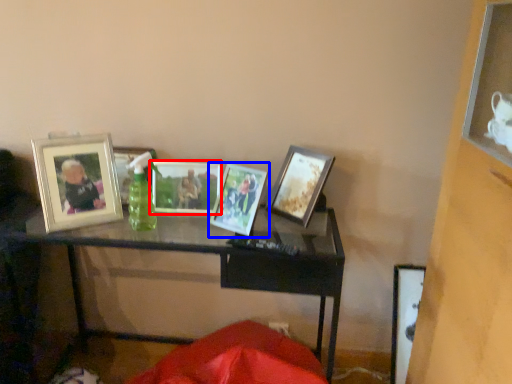
Question: Which point is closer to the camera, picture frame (highlighted by a red box) or picture frame (highlighted by a blue box)?

Choices:
 (A) picture frame
 (B) picture frame

Answer: (B)